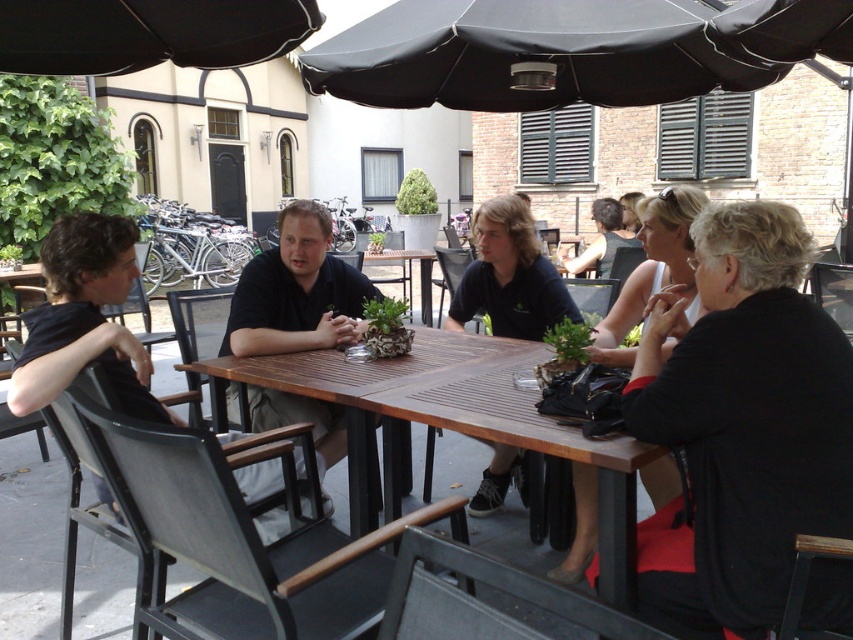
Question: Which of the following is the farthest from the observer?

Choices:
 (A) black fabric dress at right
 (B) black fabric umbrella at upper center

Answer: (B)

Question: Which of the following is the farthest from the observer?

Choices:
 (A) black fabric shirt at left
 (B) wooden table at center

Answer: (B)

Question: Where is black fabric umbrella at upper center located in relation to black matte shirt at center in the image?

Choices:
 (A) below
 (B) above

Answer: (B)

Question: In this image, where is black fabric umbrella at upper center located relative to black matte shirt at center?

Choices:
 (A) above
 (B) below

Answer: (A)

Question: Which is nearer to the black fabric umbrella at upper center?

Choices:
 (A) black matte jacket at lower right
 (B) dark blue shirt at center

Answer: (B)

Question: Does wooden table at center have a smaller size compared to black matte shirt at center?

Choices:
 (A) yes
 (B) no

Answer: (B)